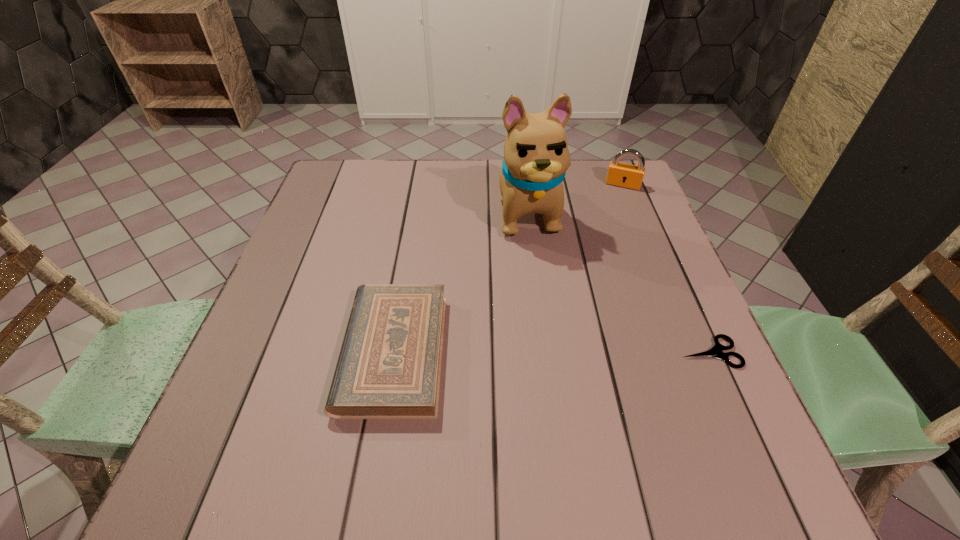
The height and width of the screenshot is (540, 960). I want to click on vacant position in the image that satisfies the following two spatial constraints: 1. on the front side of the second tallest object; 2. on the right side of the shears, so (x=691, y=353).

At what (x,y) coordinates should I click in order to perform the action: click on vacant space that satisfies the following two spatial constraints: 1. on the front side of the shortest object; 2. on the right side of the second tallest object. Please return your answer as a coordinate pair (x, y). This screenshot has width=960, height=540. Looking at the image, I should click on (691, 353).